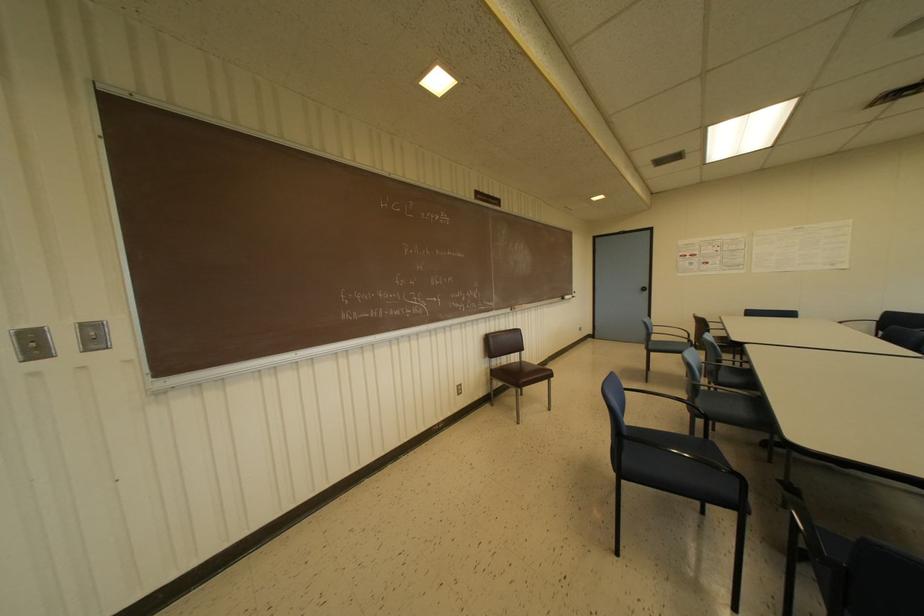
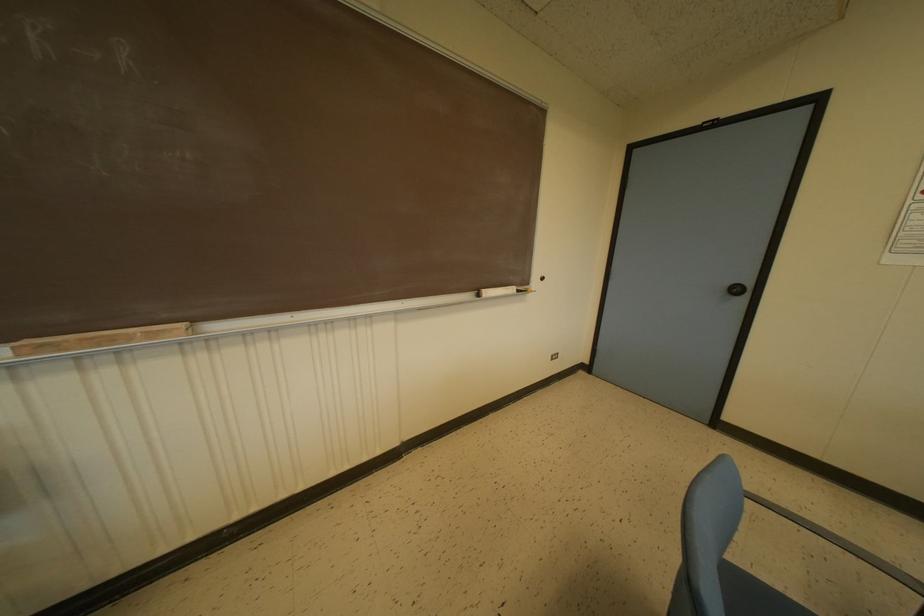
Locate, in the second image, the point that corresponds to (646,288) in the first image.

(746, 291)